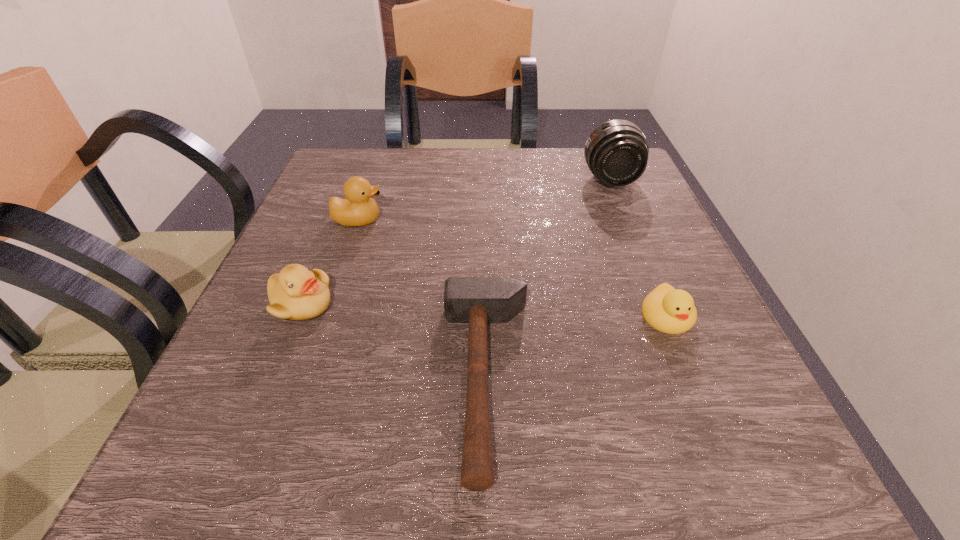
Where is `vacant point located 0.290m on the striking surface of the hammer`? This screenshot has height=540, width=960. vacant point located 0.290m on the striking surface of the hammer is located at coordinates (238, 379).

At what (x,y) coordinates should I click in order to perform the action: click on vacant area located 0.050m on the striking surface of the hammer. Please return your answer as a coordinate pair (x, y). This screenshot has width=960, height=540. Looking at the image, I should click on (406, 379).

Identify the location of free space located 0.290m on the striking surface of the hammer. (238, 379).

Locate an element on the screen. object present at the far edge is located at coordinates (616, 152).

Locate an element on the screen. The image size is (960, 540). object at the near edge is located at coordinates (475, 300).

You are a GUI agent. You are given a task and a screenshot of the screen. Output one action in this format:
    pyautogui.click(x=<x>, y=<y>)
    Task: Click on the telephoto lens at the right edge
    
    Given the screenshot: What is the action you would take?
    pyautogui.click(x=616, y=152)

At what (x,y) coordinates should I click in order to perform the action: click on duckling that is at the right edge. Please return your answer as a coordinate pair (x, y). Image resolution: width=960 pixels, height=540 pixels. Looking at the image, I should click on (666, 309).

The width and height of the screenshot is (960, 540). What are the coordinates of `object located at the far right corner` in the screenshot? It's located at (616, 152).

What are the coordinates of `free space at the far edge` in the screenshot? It's located at (544, 182).

You are a GUI agent. You are given a task and a screenshot of the screen. Output one action in this format:
    pyautogui.click(x=<x>, y=<y>)
    Task: Click on the vacant space at the near edge
    The image size is (960, 540).
    Given the screenshot: What is the action you would take?
    388,450